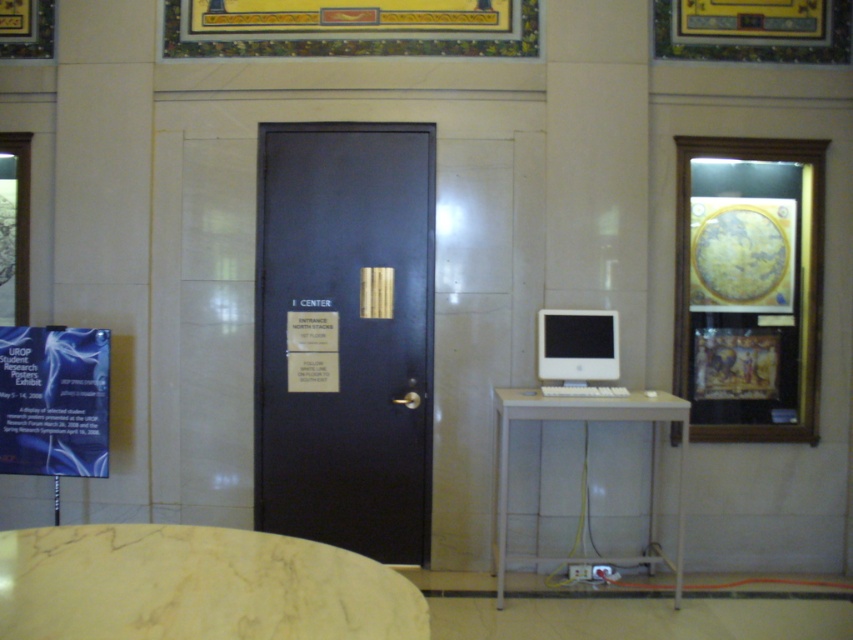
You are standing in front of the dark door labeled CENTER. You need to place a laptop on the white glossy table at center and the white glossy monitor at center. According to the scene, which object should you place the laptop on first to follow the spatial arrangement?

The white glossy table at center is to the right of the white glossy monitor at center. Since you want to follow the spatial arrangement, you should place the laptop on the white glossy monitor at center first, then move to the table on the right.

You are standing in a building and need to reach the door. There is a marble table at lower left blocking your path. Can you walk around the table to reach the matte black door at center?

The matte black door at center is positioned over marble table at lower left, which means the door is directly above the table. Since the table is on the lower left, you can walk around it to reach the door as they are not in the same vertical plane.

You are standing in front of the dark door labeled CENTER. You need to place a 5.5 feet long object between the marble table at lower left and the dark door labeled CENTER. Is there enough space?

The distance between the marble table at lower left and the dark door labeled CENTER is 4.56 feet, which is shorter than the 5.5 feet long object. Therefore, there is not enough space to place the object between them.